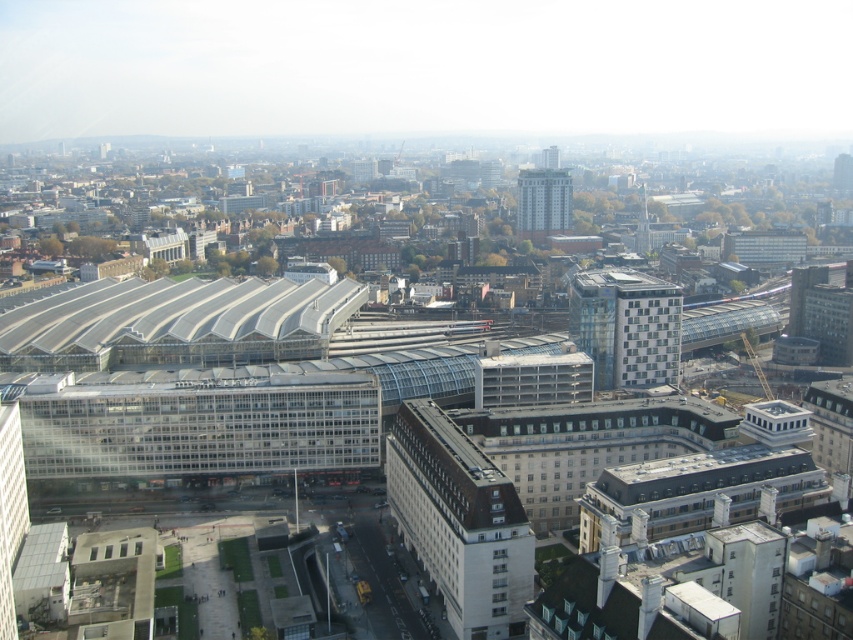
Who is shorter, dark gray concrete building at center or glassy blue building at center?

dark gray concrete building at center

The image size is (853, 640). What do you see at coordinates (459, 522) in the screenshot? I see `dark gray concrete building at center` at bounding box center [459, 522].

This screenshot has width=853, height=640. Identify the location of dark gray concrete building at center. (459, 522).

Is glassy blue building at center above gray concrete building at center?

Actually, glassy blue building at center is below gray concrete building at center.

Which is below, glassy blue building at center or gray concrete building at center?

glassy blue building at center is lower down.

Is point (602, 282) in front of point (563, 221)?

Yes, it is.

Where is `glassy blue building at center`? The width and height of the screenshot is (853, 640). glassy blue building at center is located at coordinates (625, 326).

The width and height of the screenshot is (853, 640). What do you see at coordinates (459, 522) in the screenshot? I see `dark gray concrete building at center` at bounding box center [459, 522].

Between point (445, 497) and point (548, 221), which one is positioned in front?

Point (445, 497) is in front.

What are the coordinates of `dark gray concrete building at center` in the screenshot? It's located at (x=459, y=522).